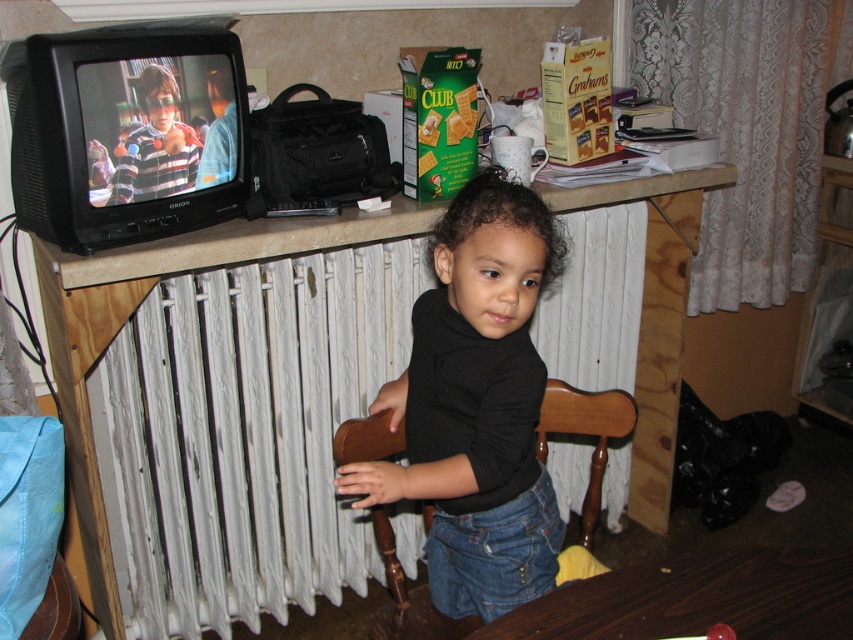
Does dark wood table at lower center appear under brown wooden chair at center?

Correct, dark wood table at lower center is located below brown wooden chair at center.

Does point (821, 596) lie in front of point (345, 456)?

Yes, it is.

Describe the element at coordinates (697, 600) in the screenshot. This screenshot has height=640, width=853. I see `dark wood table at lower center` at that location.

Where is `dark wood table at lower center`? This screenshot has height=640, width=853. dark wood table at lower center is located at coordinates (697, 600).

Is point (585, 358) closer to viewer compared to point (364, 451)?

No.

Does white painted radiator at center have a smaller size compared to brown wooden chair at center?

Incorrect, white painted radiator at center is not smaller in size than brown wooden chair at center.

Who is more forward, (178, 428) or (546, 417)?

Point (546, 417) is in front.

Find the location of a particular element. This screenshot has width=853, height=640. white painted radiator at center is located at coordinates (245, 435).

Can you confirm if black matte shirt at center is shorter than brown wooden chair at center?

No, black matte shirt at center is not shorter than brown wooden chair at center.

What do you see at coordinates (476, 404) in the screenshot? The width and height of the screenshot is (853, 640). I see `black matte shirt at center` at bounding box center [476, 404].

Identify the location of black matte shirt at center. (476, 404).